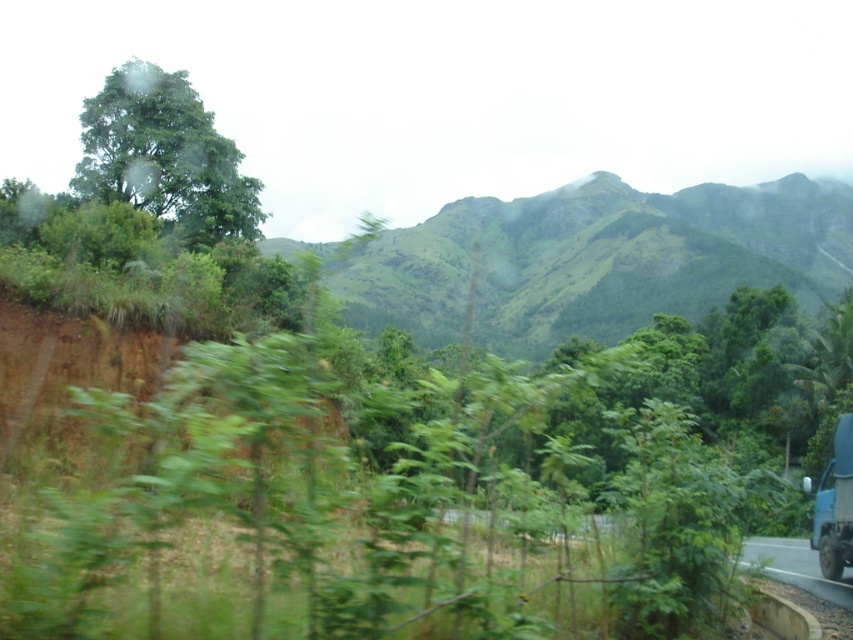
You are standing at the point with coordinates point (x=109, y=193) and want to walk towards the mountain. Is the point (x=680, y=292) located behind you or in front of you?

The point (x=680, y=292) is behind point (x=109, y=193), so it is behind you.

You are a hiker standing at the base of the green grassy mountain at center and looking towards the green leafy tree at upper left. Which object is closer to you?

The green grassy mountain at center is closer to you than the green leafy tree at upper left because the tree is positioned behind the mountain.

You are standing in the lush green landscape looking at the mountain backdrop. There are two points marked in the image. The first point is at coordinates point [454,330] and the second is at point [831,557]. If you were to walk towards the mountains, which point would you encounter first?

You would encounter point [454,330] first because it is closer to you than point [831,557], which is further away in the scene.